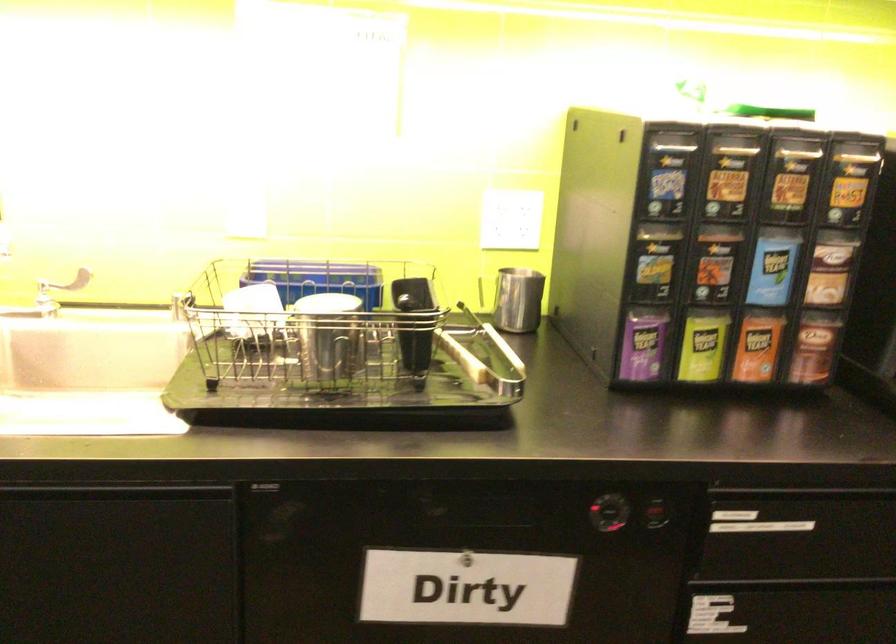
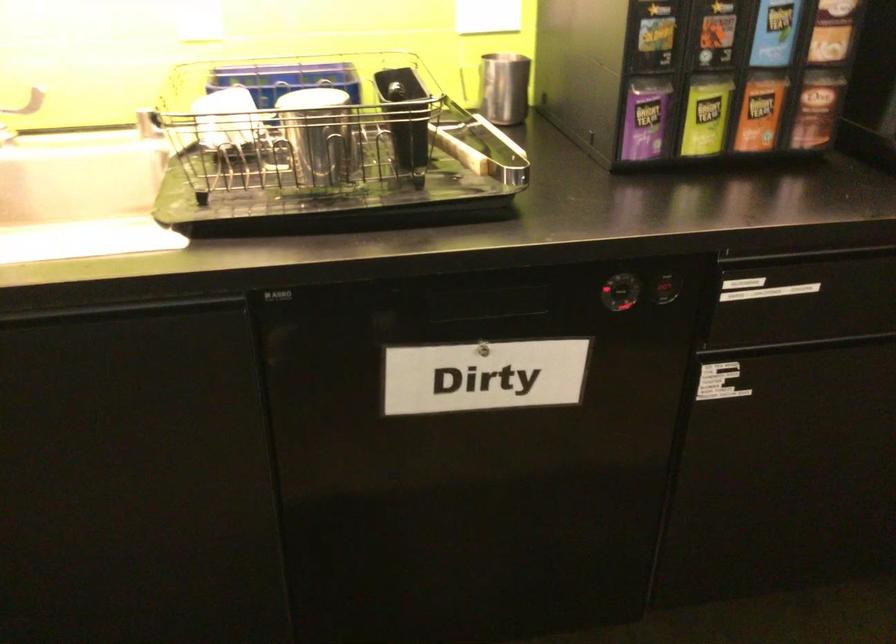
Locate, in the second image, the point that corresponds to point 517,299 in the first image.

(504, 88)